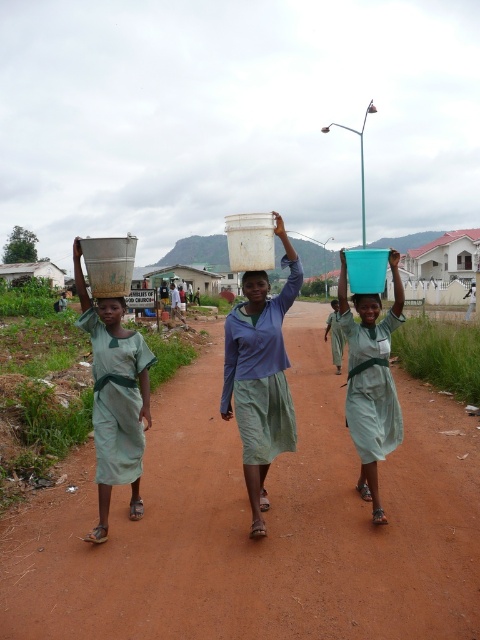
Question: Which point is closer to the camera?

Choices:
 (A) (109, 323)
 (B) (363, 307)

Answer: (A)

Question: Can you confirm if blue matte bucket at center is positioned to the left of matte plastic head at center?

Choices:
 (A) yes
 (B) no

Answer: (B)

Question: Can you confirm if brown dirt track at center is wider than matte plastic head at center?

Choices:
 (A) yes
 (B) no

Answer: (A)

Question: Which is nearer to the matte plastic head at upper center?

Choices:
 (A) matte plastic head at center
 (B) matte white bucket at center

Answer: (A)

Question: Considering the real-world distances, which object is farthest from the blue matte bucket at center?

Choices:
 (A) matte plastic head at center
 (B) matte plastic bucket at center
 (C) brown dirt track at center
 (D) metallic silver bucket at upper left

Answer: (D)

Question: Can you confirm if brown dirt track at center is bigger than matte white bucket at center?

Choices:
 (A) yes
 (B) no

Answer: (A)